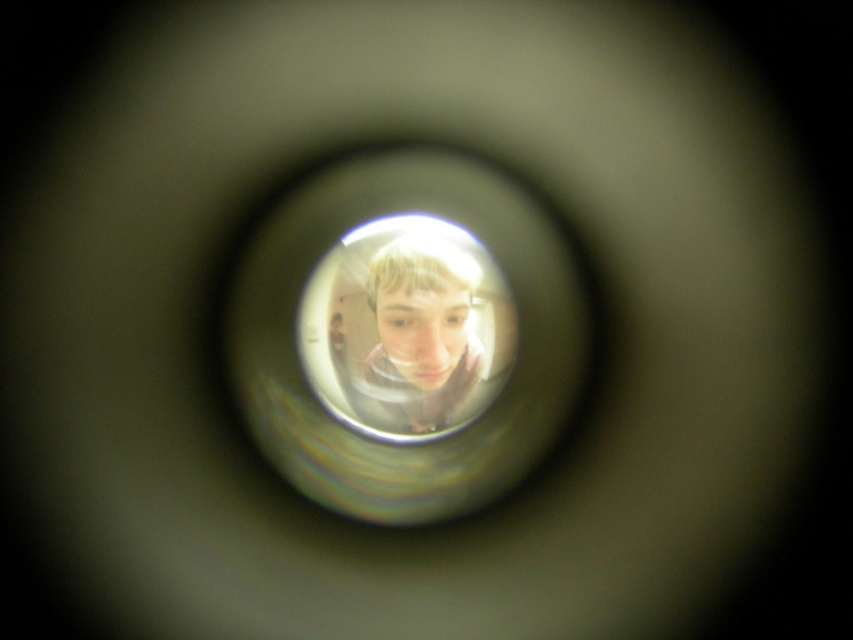
Question: Does transparent glass lens at center appear under smooth skin face at center?

Choices:
 (A) no
 (B) yes

Answer: (B)

Question: Can you confirm if transparent plastic lens at center is positioned below smooth skin face at center?

Choices:
 (A) no
 (B) yes

Answer: (A)

Question: Does transparent glass lens at center appear under smooth skin face at center?

Choices:
 (A) no
 (B) yes

Answer: (B)

Question: Which object appears closest to the camera in this image?

Choices:
 (A) transparent plastic lens at center
 (B) transparent glass lens at center
 (C) smooth skin face at center

Answer: (B)

Question: Which point is farther from the camera taking this photo?

Choices:
 (A) (299, 472)
 (B) (421, 346)
 (C) (419, 362)

Answer: (C)

Question: Which of the following is the farthest from the observer?

Choices:
 (A) (380, 333)
 (B) (461, 189)

Answer: (A)